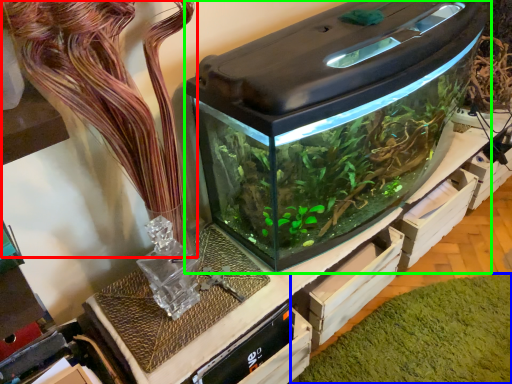
Question: Estimate the real-world distances between objects in this image. Which object is farther from plant (highlighted by a red box), algae (highlighted by a blue box) or home appliance (highlighted by a green box)?

Choices:
 (A) algae
 (B) home appliance

Answer: (A)